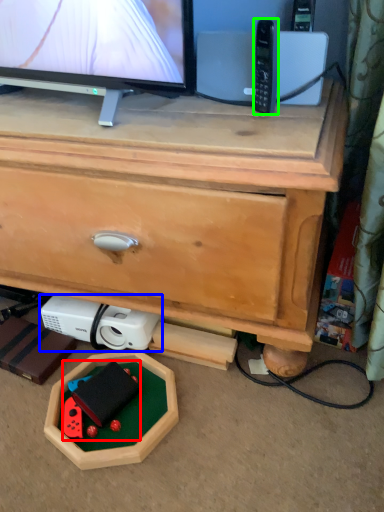
Question: Estimate the real-world distances between objects in this image. Which object is farther from toy (highlighted by a red box), appliance (highlighted by a blue box) or control (highlighted by a green box)?

Choices:
 (A) appliance
 (B) control

Answer: (B)